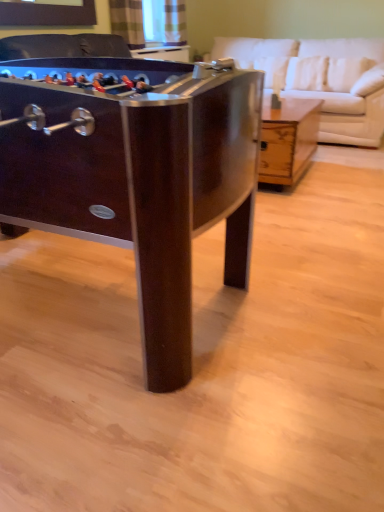
Question: Considering the relative positions of dark wood foosball table at left, positioned as the 2th table in right-to-left order, and white leather couch at upper right in the image provided, is dark wood foosball table at left, positioned as the 2th table in right-to-left order, to the right of white leather couch at upper right from the viewer's perspective?

Choices:
 (A) no
 (B) yes

Answer: (A)

Question: Is dark wood foosball table at left, which is the first table in left-to-right order, smaller than white leather couch at upper right?

Choices:
 (A) no
 (B) yes

Answer: (A)

Question: Does dark wood foosball table at left, the 1th table positioned from the front, lie behind white leather couch at upper right?

Choices:
 (A) no
 (B) yes

Answer: (A)

Question: From a real-world perspective, is dark wood foosball table at left, which ranks as the 2th table in back-to-front order, under white leather couch at upper right?

Choices:
 (A) no
 (B) yes

Answer: (B)

Question: From the image's perspective, is dark wood foosball table at left, positioned as the 2th table in right-to-left order, on top of white leather couch at upper right?

Choices:
 (A) no
 (B) yes

Answer: (A)

Question: Is dark wood foosball table at left, positioned as the 2th table in right-to-left order, at the left side of white leather couch at upper right?

Choices:
 (A) yes
 (B) no

Answer: (A)

Question: Does wooden coffee table at center, marked as the second table in a front-to-back arrangement, have a lesser height compared to dark wood foosball table at left, the 1th table positioned from the front?

Choices:
 (A) no
 (B) yes

Answer: (B)

Question: Is wooden coffee table at center, which is counted as the 1th table, starting from the back, to the right of dark wood foosball table at left, which is the first table in left-to-right order, from the viewer's perspective?

Choices:
 (A) yes
 (B) no

Answer: (A)

Question: Does wooden coffee table at center, the 1th table viewed from the right, have a greater width compared to dark wood foosball table at left, which is the first table in left-to-right order?

Choices:
 (A) yes
 (B) no

Answer: (B)

Question: From a real-world perspective, is wooden coffee table at center, marked as the second table in a front-to-back arrangement, positioned over dark wood foosball table at left, which is the first table in left-to-right order, based on gravity?

Choices:
 (A) yes
 (B) no

Answer: (B)

Question: Is wooden coffee table at center, which is counted as the 1th table, starting from the back, to the left of dark wood foosball table at left, positioned as the 2th table in right-to-left order, from the viewer's perspective?

Choices:
 (A) yes
 (B) no

Answer: (B)

Question: Can you confirm if wooden coffee table at center, the 2th table viewed from the left, is smaller than dark wood foosball table at left, which is the first table in left-to-right order?

Choices:
 (A) yes
 (B) no

Answer: (A)

Question: Is white leather couch at upper right further to camera compared to dark wood foosball table at left, positioned as the 2th table in right-to-left order?

Choices:
 (A) no
 (B) yes

Answer: (B)